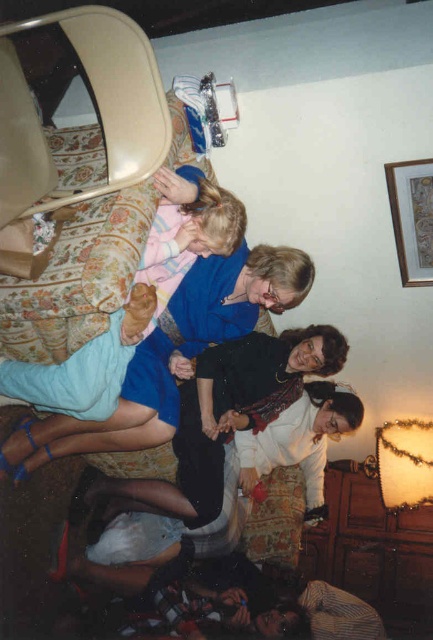
Between blue fabric dress at center and light blue denim pants at center, which one appears on the right side from the viewer's perspective?

blue fabric dress at center is more to the right.

Is blue fabric dress at center below light blue denim pants at center?

Yes.

Who is more distant from viewer, [190,372] or [212,250]?

Point [190,372]

Locate an element on the screen. The image size is (433, 640). blue fabric dress at center is located at coordinates (173, 353).